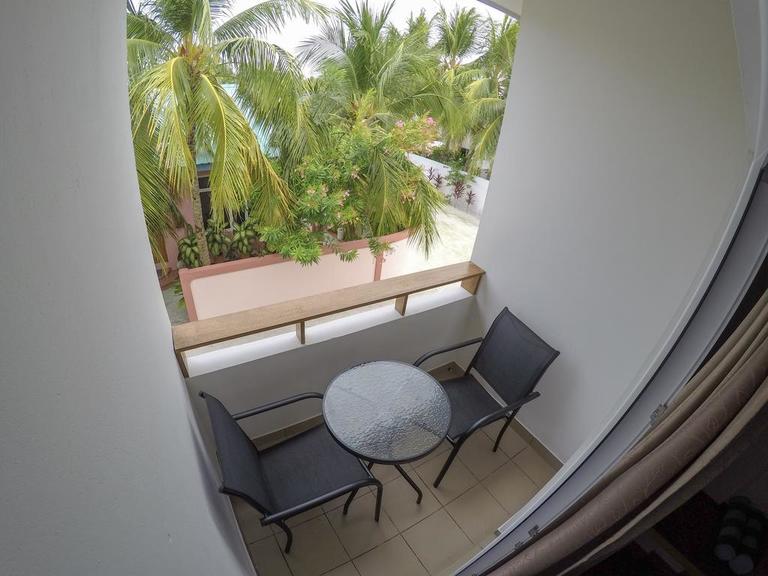
Locate an element on the screen. This screenshot has width=768, height=576. walls is located at coordinates (80, 429), (624, 202).